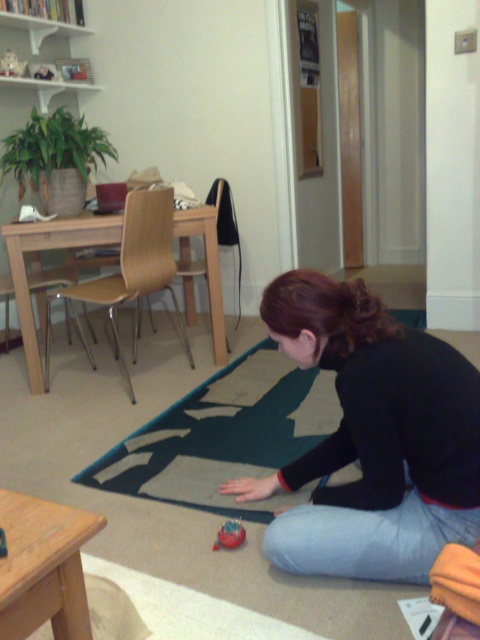
Between wooden stool at lower left and rubberized red toy at lower left, which one is positioned higher?

Positioned higher is rubberized red toy at lower left.

Is point (25, 547) in front of point (1, 556)?

No, it is not.

Locate an element on the screen. Image resolution: width=480 pixels, height=640 pixels. wooden stool at lower left is located at coordinates (44, 566).

How much distance is there between shiny red ball at lower center and rubberized red toy at lower left?

A distance of 76.39 centimeters exists between shiny red ball at lower center and rubberized red toy at lower left.

Which is in front, point (224, 528) or point (0, 557)?

Point (0, 557) is in front.

Identify the location of shiny red ball at lower center. (229, 536).

Between point (288, 454) and point (0, 522), which one is positioned in front?

Point (0, 522) is in front.

Who is more distant from viewer, (x=105, y=472) or (x=11, y=608)?

The point (x=105, y=472) is behind.

Where is `dark green fabric mat at lower center`? The image size is (480, 640). dark green fabric mat at lower center is located at coordinates (222, 435).